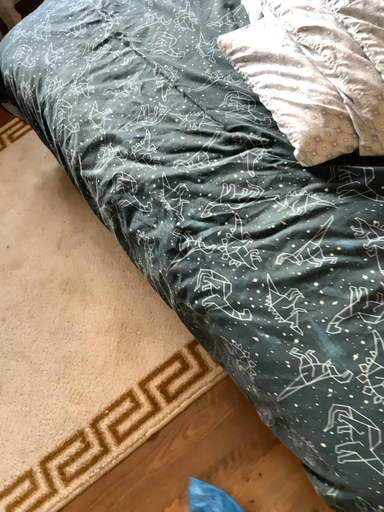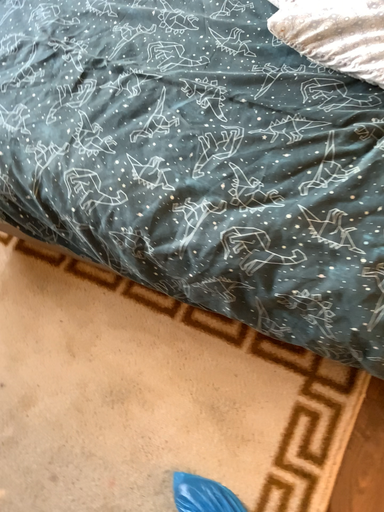
Question: How did the camera likely rotate when shooting the video?

Choices:
 (A) rotated right
 (B) rotated left

Answer: (A)